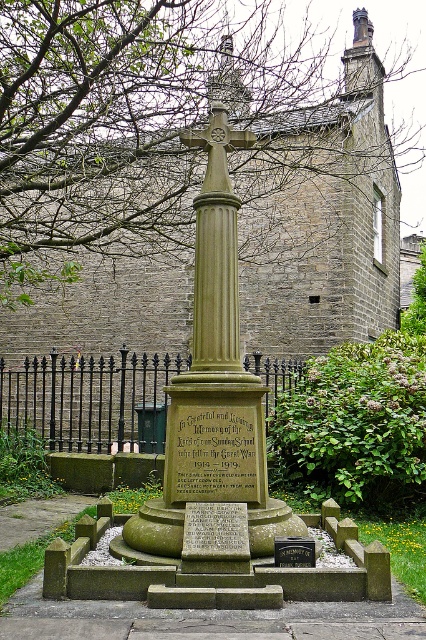
Question: Is the position of smooth stone cross at center more distant than that of black polished stone plaque at center?

Choices:
 (A) yes
 (B) no

Answer: (A)

Question: Does smooth stone cross at center have a smaller size compared to black polished stone plaque at center?

Choices:
 (A) no
 (B) yes

Answer: (A)

Question: Is smooth stone cross at center wider than black polished stone plaque at center?

Choices:
 (A) no
 (B) yes

Answer: (B)